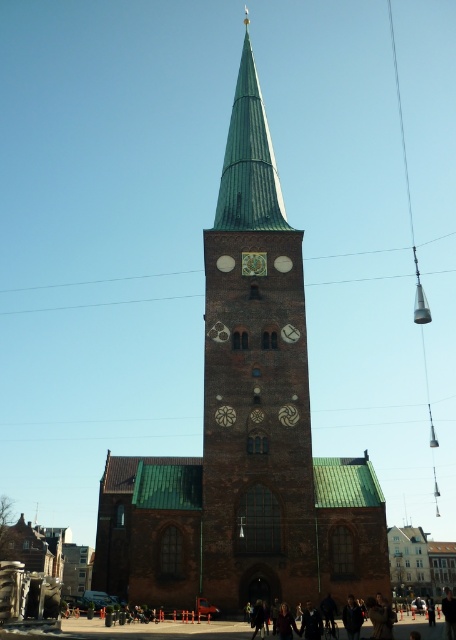
Question: Does brown stone church at center have a greater width compared to green stone church tower at center?

Choices:
 (A) no
 (B) yes

Answer: (B)

Question: Which object is the closest to the green stone church tower at center?

Choices:
 (A) green copper spire at center
 (B) brown stone church at center

Answer: (B)

Question: Considering the relative positions of green stone church tower at center and gold textured clock at center in the image provided, where is green stone church tower at center located with respect to gold textured clock at center?

Choices:
 (A) below
 (B) above

Answer: (B)

Question: Can you confirm if green stone church tower at center is positioned above green copper spire at center?

Choices:
 (A) no
 (B) yes

Answer: (A)

Question: Which object is farther from the camera taking this photo?

Choices:
 (A) brown stone church at center
 (B) gold textured clock at center

Answer: (B)

Question: Which point appears closest to the camera in this image?

Choices:
 (A) (234, 417)
 (B) (259, 193)

Answer: (A)